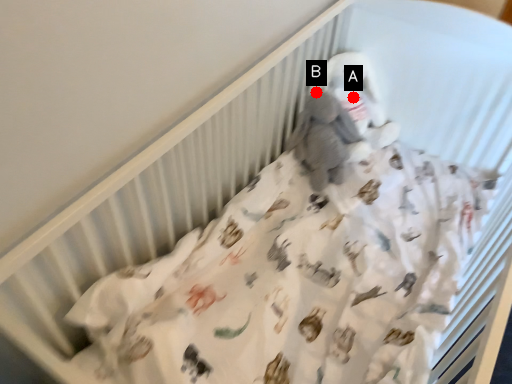
Question: Two points are circled on the image, labeled by A and B beside each circle. Which point is farther to the camera?

Choices:
 (A) A is further
 (B) B is further

Answer: (A)